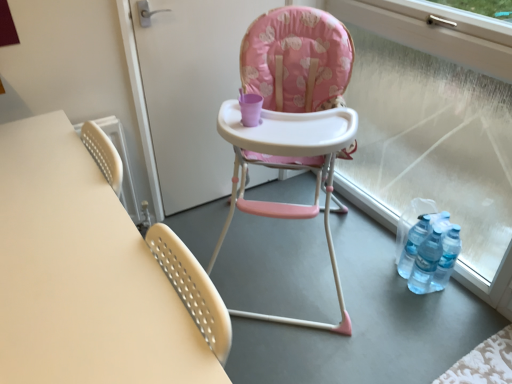
Question: Can you confirm if pink fabric highchair at center is positioned to the left of pink fabric high chair at center?

Choices:
 (A) yes
 (B) no

Answer: (B)

Question: Is pink fabric highchair at center looking in the opposite direction of pink fabric high chair at center?

Choices:
 (A) no
 (B) yes

Answer: (A)

Question: Is pink fabric highchair at center not inside pink fabric high chair at center?

Choices:
 (A) no
 (B) yes

Answer: (B)

Question: From the image's perspective, would you say pink fabric highchair at center is shown under pink fabric high chair at center?

Choices:
 (A) yes
 (B) no

Answer: (A)

Question: Are pink fabric highchair at center and pink fabric high chair at center located far from each other?

Choices:
 (A) no
 (B) yes

Answer: (A)

Question: Does pink fabric highchair at center have a lesser width compared to pink fabric high chair at center?

Choices:
 (A) no
 (B) yes

Answer: (A)

Question: Is pink fabric high chair at center taller than matte white table at left?

Choices:
 (A) yes
 (B) no

Answer: (A)

Question: Can you see pink fabric high chair at center touching matte white table at left?

Choices:
 (A) no
 (B) yes

Answer: (A)

Question: From the image's perspective, is pink fabric high chair at center beneath matte white table at left?

Choices:
 (A) no
 (B) yes

Answer: (A)

Question: Is pink fabric high chair at center far away from matte white table at left?

Choices:
 (A) no
 (B) yes

Answer: (A)

Question: Is pink fabric high chair at center not within matte white table at left?

Choices:
 (A) no
 (B) yes

Answer: (B)

Question: Is pink fabric high chair at center oriented towards matte white table at left?

Choices:
 (A) yes
 (B) no

Answer: (B)

Question: Can you confirm if pink fabric highchair at center is taller than matte white table at left?

Choices:
 (A) yes
 (B) no

Answer: (A)